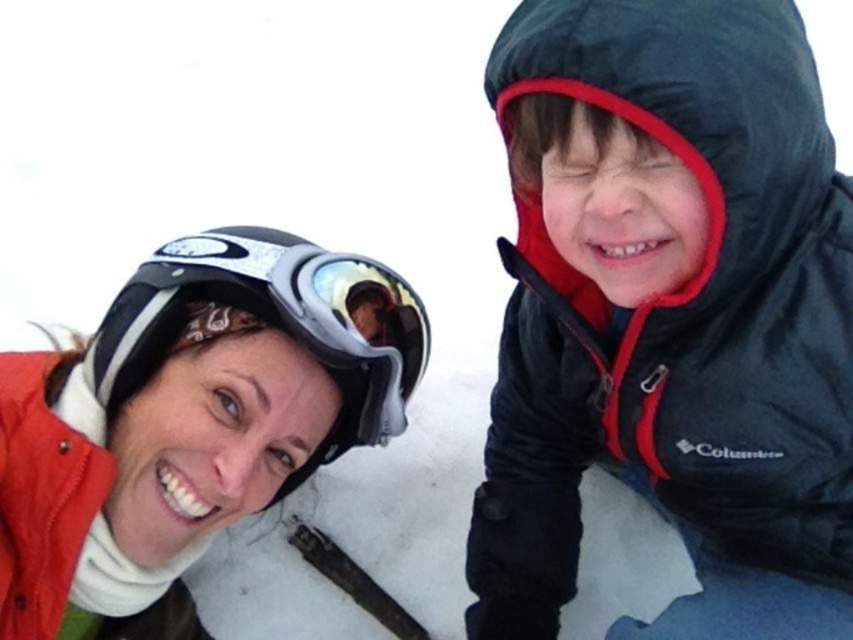
Is matte black jacket at upper right further to the viewer compared to matte black helmet at upper left?

No, it is in front of matte black helmet at upper left.

Who is lower down, matte black jacket at upper right or matte black helmet at upper left?

matte black helmet at upper left is lower down.

This screenshot has width=853, height=640. Describe the element at coordinates (668, 301) in the screenshot. I see `matte black jacket at upper right` at that location.

This screenshot has width=853, height=640. Find the location of `matte black jacket at upper right`. matte black jacket at upper right is located at coordinates (668, 301).